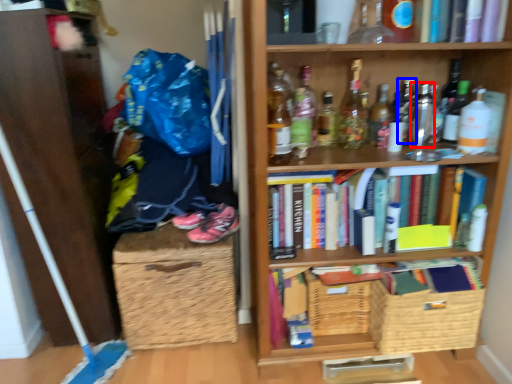
Question: Which object is closer to the camera taking this photo, bottle (highlighted by a red box) or bottle (highlighted by a blue box)?

Choices:
 (A) bottle
 (B) bottle

Answer: (A)